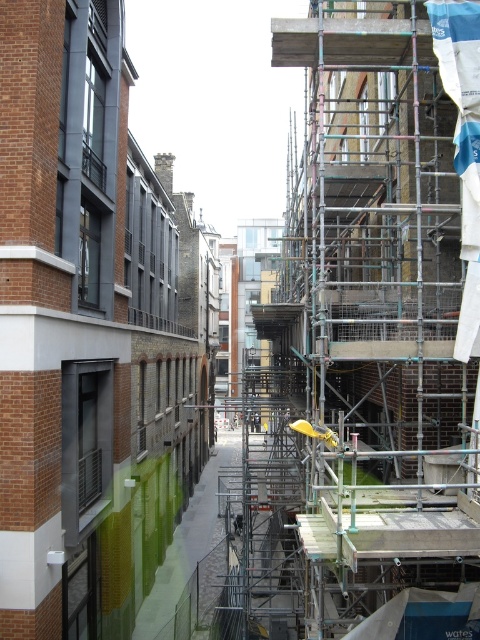
Based on the photo, you are a drone operator trying to navigate a small drone through an urban alleyway. You have two points marked on your map as coordinates. The first point is at point (130, 248) and the second is at point (478, 316). Your drone needs to fly from the first point to the second point. However, there are construction obstacles in the alleyway. Based on the scene description, can you determine if the path between these two points is clear?

Point (130, 248) is behind point (478, 316), so the path between them is blocked by construction obstacles in the alleyway.

You are a delivery person trying to navigate through the alleyway. You see the green matte wall at center and the metal scaffolding at center. Which one is located to the left side of the other?

The green matte wall at center is positioned on the left side of metal scaffolding at center, so the green matte wall at center is to the left of the metal scaffolding at center.

You are a painter who needs to assess the height of two structures in the alleyway. Given that your ladder can only reach up to 3 meters, can you determine which structure, the green matte wall at center or the metal scaffolding at center, you can safely paint without needing a taller ladder?

The green matte wall at center has a greater height compared to the metal scaffolding at center. Since your ladder reaches up to 3 meters, you can safely paint the metal scaffolding at center if its height is within the ladder limit, but the green matte wall at center may exceed it. However, the exact heights aren not provided, so you should measure both to confirm.